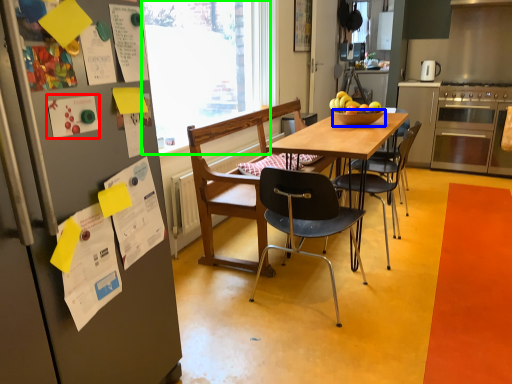
Question: Which is farther away from poster (highlighted by a red box)? bowl (highlighted by a blue box) or window screen (highlighted by a green box)?

Choices:
 (A) bowl
 (B) window screen

Answer: (B)